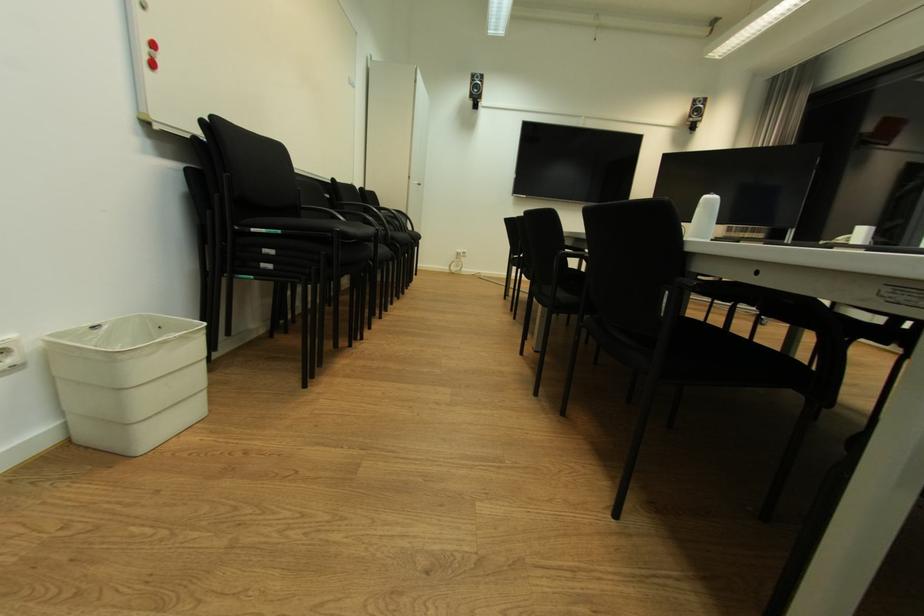
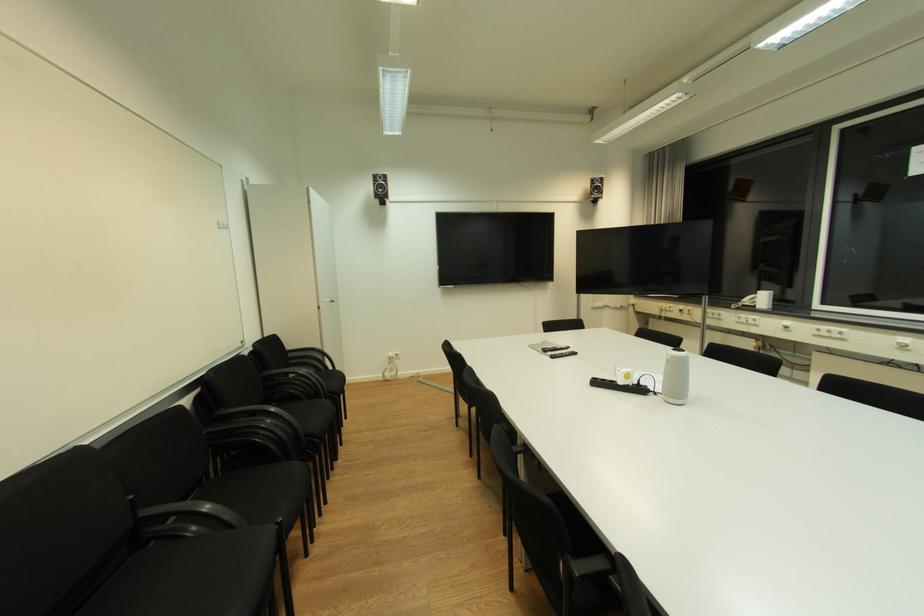
In the second image, find the point that corresponds to (x=711, y=201) in the first image.

(678, 358)